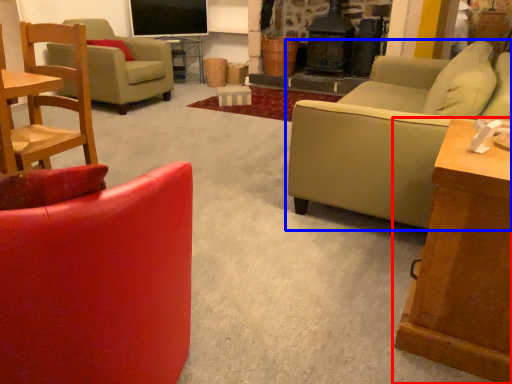
Question: Among these objects, which one is farthest to the camera, table (highlighted by a red box) or studio couch (highlighted by a blue box)?

Choices:
 (A) table
 (B) studio couch

Answer: (B)